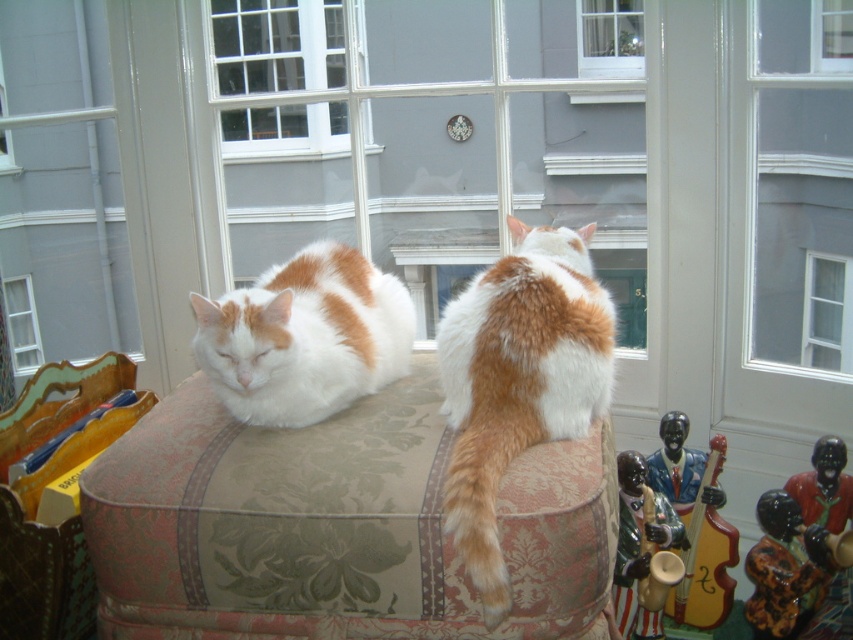
You are a cat owner trying to decide which window to open for ventilation. You see the clear glass window at center and the clear glass window at upper left. Which window is taller?

The clear glass window at center is taller than the clear glass window at upper left, so you should choose the clear glass window at center for better ventilation.

You are a cat owner who wants to place a 1.2 meter long cat tree between the white glass window at upper center and the porcelain black man at lower right. Will there be enough space to fit it without moving either object?

The distance between the white glass window at upper center and the porcelain black man at lower right is 1.03 meters. Since the cat tree is 1.2 meters long, it will not fit in the available space.